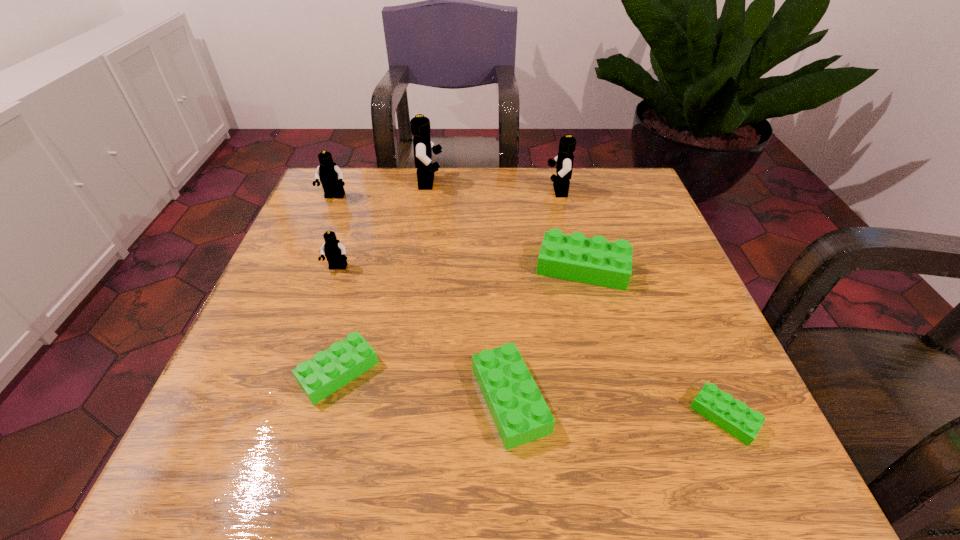
Where is `vacant space located 0.390m on the front-facing side of the leftmost black Lego`? The width and height of the screenshot is (960, 540). vacant space located 0.390m on the front-facing side of the leftmost black Lego is located at coordinates (281, 324).

At what (x,y) coordinates should I click in order to perform the action: click on free space located 0.330m on the front-facing side of the nearest black Lego. Please return your answer as a coordinate pair (x, y). The width and height of the screenshot is (960, 540). Looking at the image, I should click on (285, 424).

The width and height of the screenshot is (960, 540). I want to click on vacant space located 0.140m on the left of the fourth shortest Lego, so [468, 268].

Locate an element on the screen. The image size is (960, 540). free spot located 0.390m on the back of the fourth object from right to left is located at coordinates (500, 220).

Identify the location of vacant space located 0.370m on the back of the leftmost green Lego. The width and height of the screenshot is (960, 540). (380, 217).

Locate an element on the screen. The width and height of the screenshot is (960, 540). free location located 0.260m on the left of the rightmost green Lego is located at coordinates (523, 416).

Where is `object that is at the far left corner`? The height and width of the screenshot is (540, 960). object that is at the far left corner is located at coordinates (331, 176).

I want to click on object that is at the near right corner, so click(x=733, y=416).

Locate an element on the screen. This screenshot has width=960, height=540. free space at the far edge is located at coordinates (496, 218).

Image resolution: width=960 pixels, height=540 pixels. I want to click on free space at the left edge, so click(345, 272).